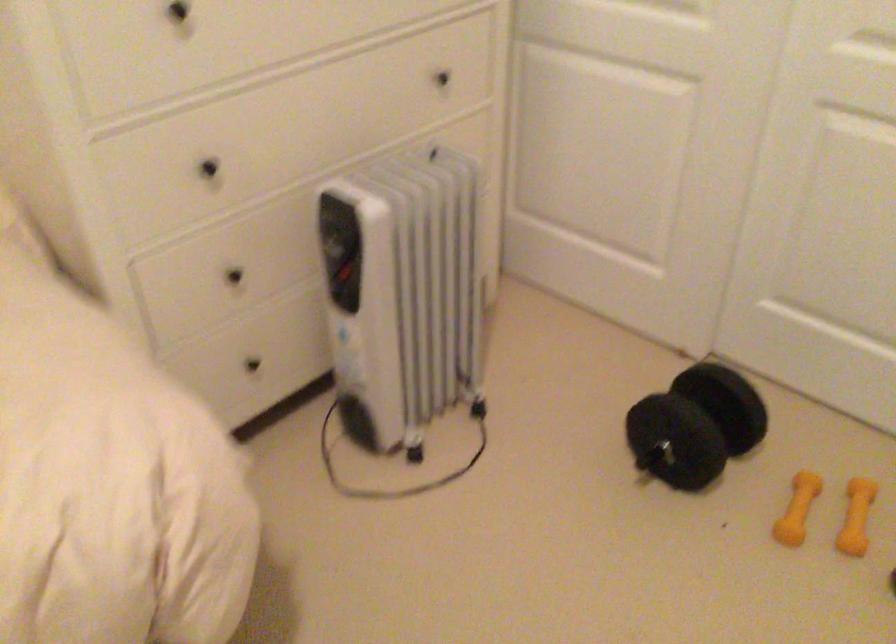
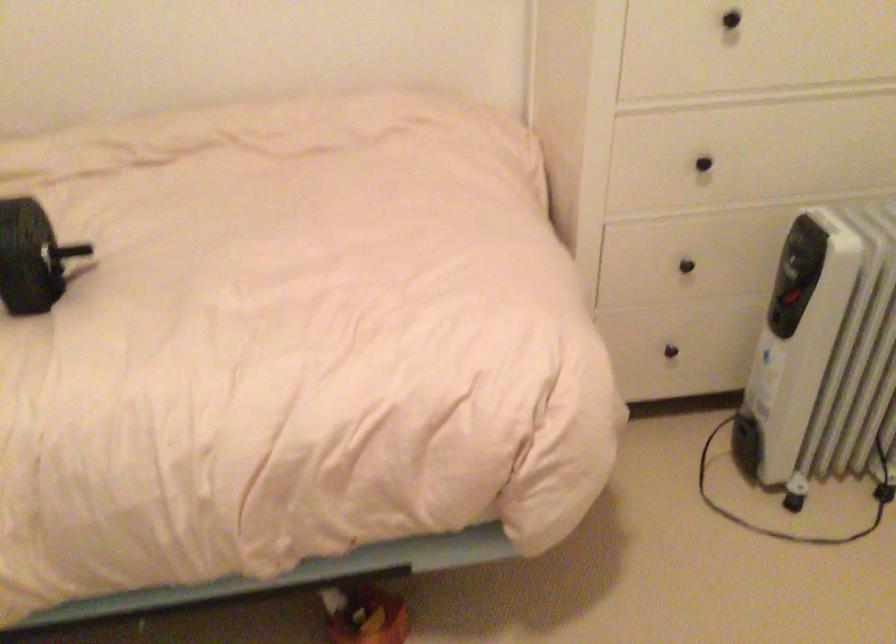
In the second image, find the point that corresponds to pixel 248 366 in the first image.

(670, 351)